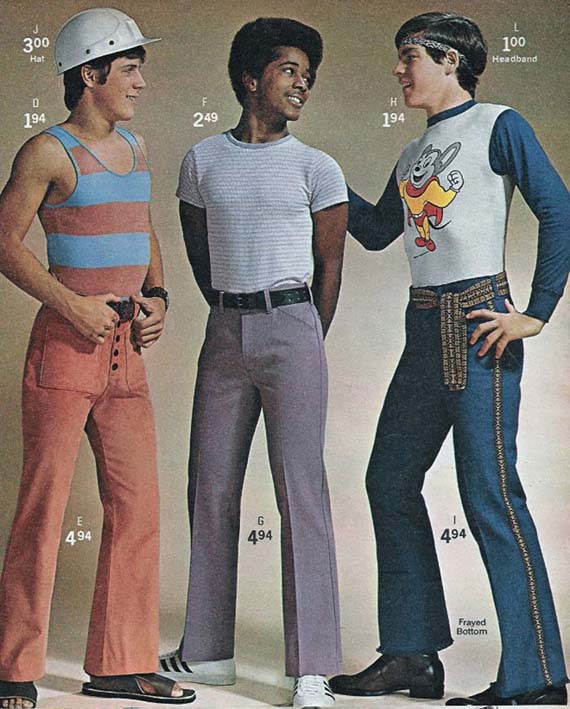
The height and width of the screenshot is (709, 570). In order to click on wall in this screenshot , I will do `click(357, 403)`.